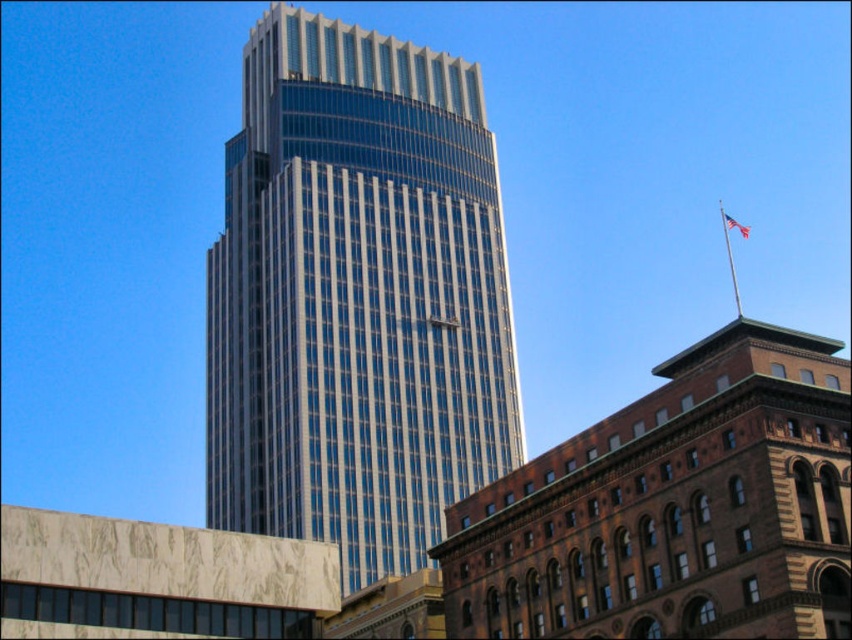
You are standing in the middle of the street looking at the glassy steel skyscraper at center and the red fabric flag at upper right. Which object is nearer to you?

The glassy steel skyscraper at center is closer to the viewer than the red fabric flag at upper right.

You are a photographer trying to capture the glassy steel skyscraper at center and the red fabric flag at upper right in the same frame. Based on their positions, which object should you adjust your camera to focus on first if you want to include both in your shot?

The glassy steel skyscraper at center is to the left of the red fabric flag at upper right, so you should focus on the red fabric flag at upper right first to ensure both are in frame.

You are a photographer standing in the middle of the street looking at the glassy steel skyscraper at center and the red fabric flag at upper right. Which object is higher up in the image?

The red fabric flag at upper right is higher up in the image than the glassy steel skyscraper at center.